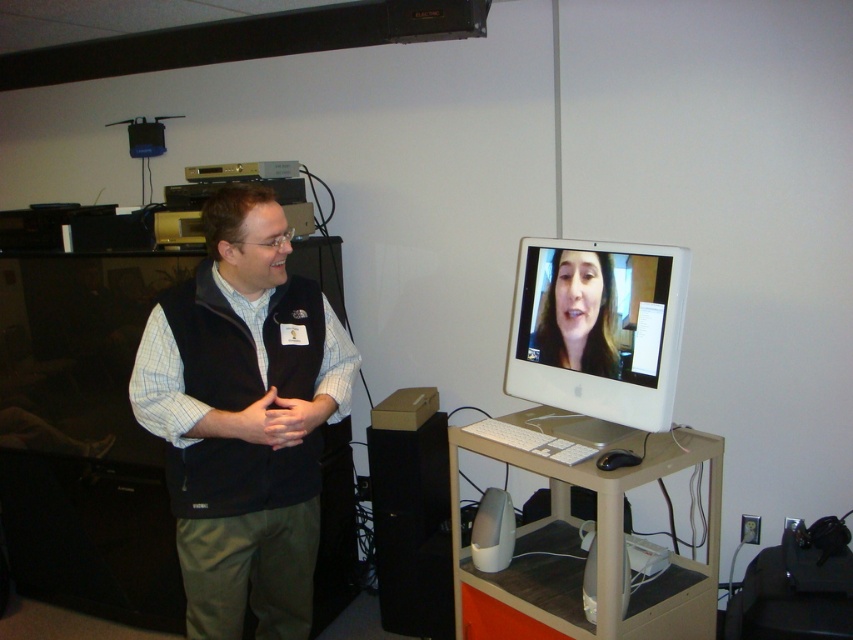
You are a virtual assistant trying to determine the position of objects in the scene. Is the black fleece vest at left located below the smooth skin face at center?

Yes, the black fleece vest at left is positioned under smooth skin face at center, so it is located below it.

You are setting up a new monitor for a video call. The beige plastic computer desk at lower center currently holds a keyboard and mouse. If the new monitor is the same size as the white glossy computer monitor at center, will there be enough space on the desk to place it without moving existing items?

The beige plastic computer desk at lower center has a larger width than the white glossy computer monitor at center. Since the desk is wider, there should be enough space to place the new monitor alongside the existing keyboard and mouse without needing to move them.

You are organizing a virtual meeting and need to place a webcam on the desk. The webcam requires a space 10 cm to the right of the white glossy computer monitor at center. Is there enough space on the beige plastic computer desk at lower center for this placement?

The beige plastic computer desk at lower center is to the left of the white glossy computer monitor at center, so placing the webcam 10 cm to the right of the monitor may not be possible if the desk does not extend beyond the monitor on that side. Check the desk dimensions to confirm.